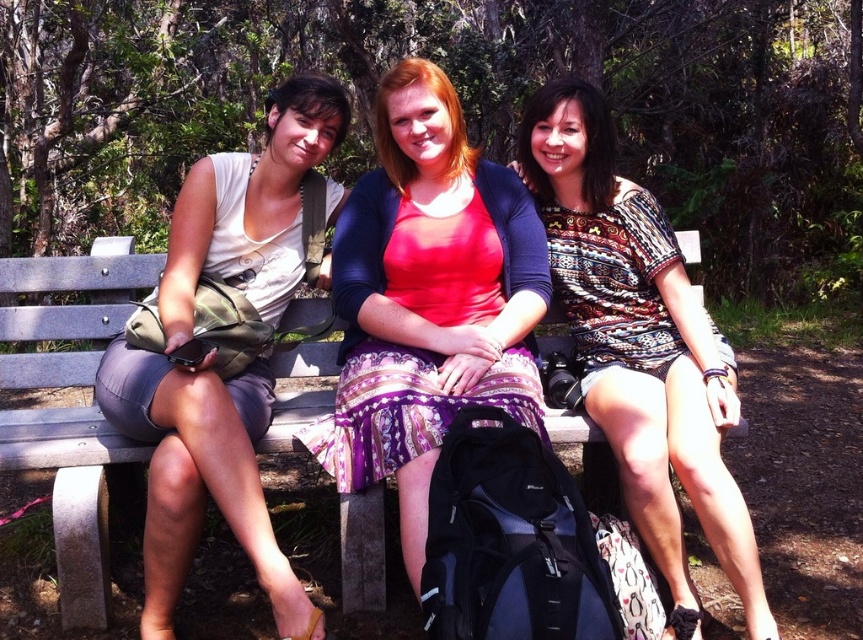
In the park scene, there are two people wearing the printed cotton dress at center and the matte white tank top at left. Which one is positioned to the right of the other?

The printed cotton dress at center is positioned to the right of the matte white tank top at left.

You are taking a photo of the three people sitting on the wooden bench in the park. You want to focus on the person at point (221, 230) and the person at point (36, 324). Which of these two points should you adjust your focus to first to ensure both are in clear view?

Point (221, 230) is closer to the camera than point (36, 324). To ensure both are in focus, adjust your focus starting with the closer point (221, 230) first.

You are standing in the park and see two people sitting on the bench. The person on the left is wearing the matte white tank top at left, and the person in the middle is wearing the printed cotton dress at center. Which person is closer to you?

The printed cotton dress at center is closer to you because the matte white tank top at left is behind it.